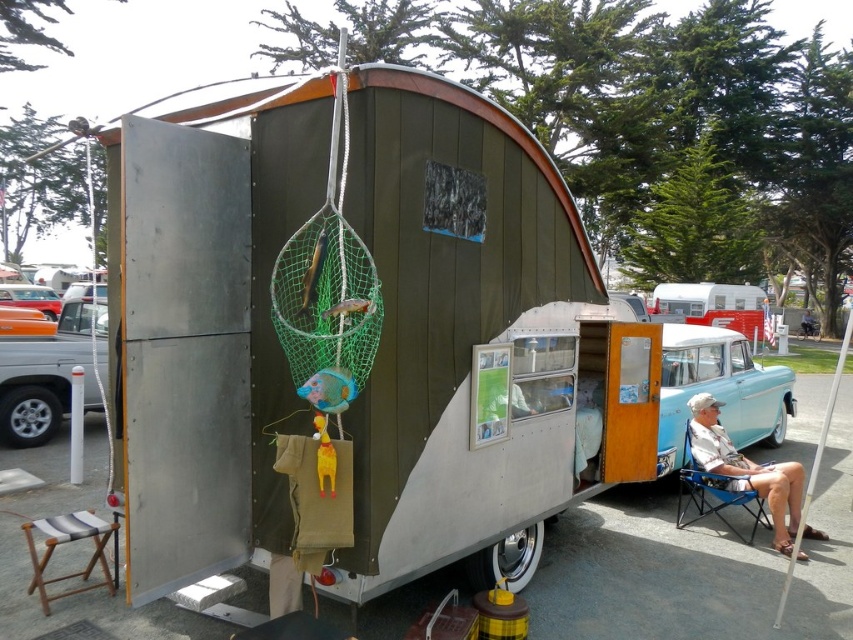
This screenshot has width=853, height=640. What do you see at coordinates (718, 390) in the screenshot? I see `light blue vintage car at right` at bounding box center [718, 390].

Can you confirm if light blue vintage car at right is positioned to the right of brushed metal truck at left?

Indeed, light blue vintage car at right is positioned on the right side of brushed metal truck at left.

Where is `light blue vintage car at right`? The width and height of the screenshot is (853, 640). light blue vintage car at right is located at coordinates pos(718,390).

Does light blue vintage car at right have a larger size compared to striped fabric stool at lower left?

Indeed, light blue vintage car at right has a larger size compared to striped fabric stool at lower left.

Measure the distance between point (734, 358) and camera.

Point (734, 358) and camera are 8.16 meters apart.

Who is more distant from viewer, [662,461] or [54,529]?

The point [662,461] is more distant.

Find the location of a particular element. light blue vintage car at right is located at coordinates (718, 390).

Can you confirm if light blue vintage car at right is smaller than blue fabric chair at lower right?

Incorrect, light blue vintage car at right is not smaller in size than blue fabric chair at lower right.

Between light blue vintage car at right and blue fabric chair at lower right, which one has more height?

With more height is light blue vintage car at right.

Which is behind, point (770, 369) or point (738, 496)?

Point (770, 369)

Locate an element on the screen. The image size is (853, 640). light blue vintage car at right is located at coordinates (718, 390).